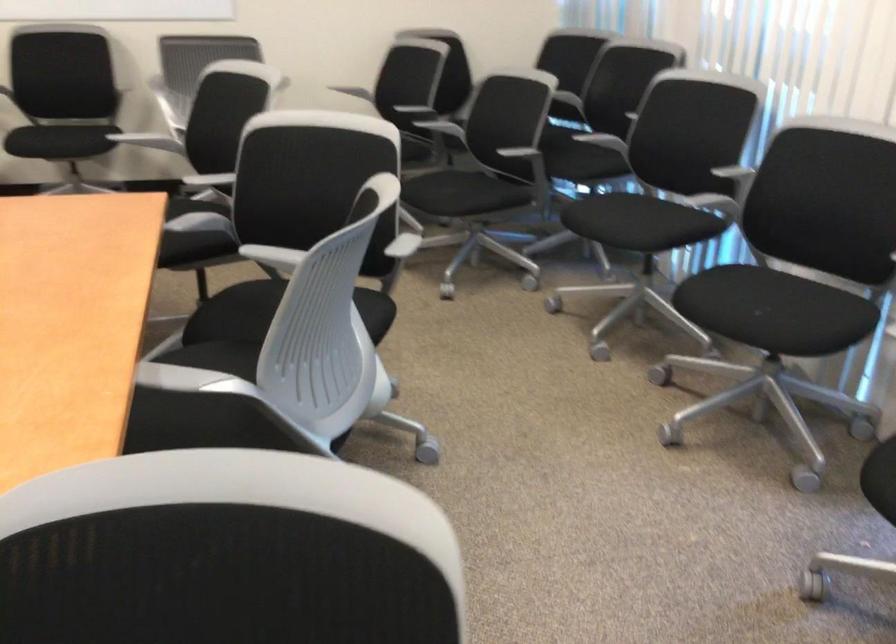
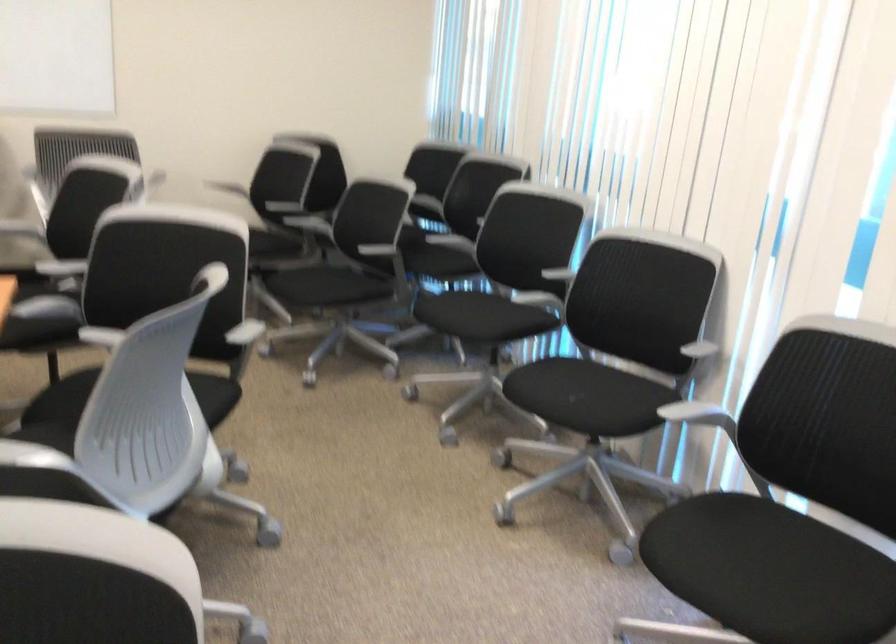
What movement of the cameraman would produce the second image?

The movement direction of the cameraman is right, backward.